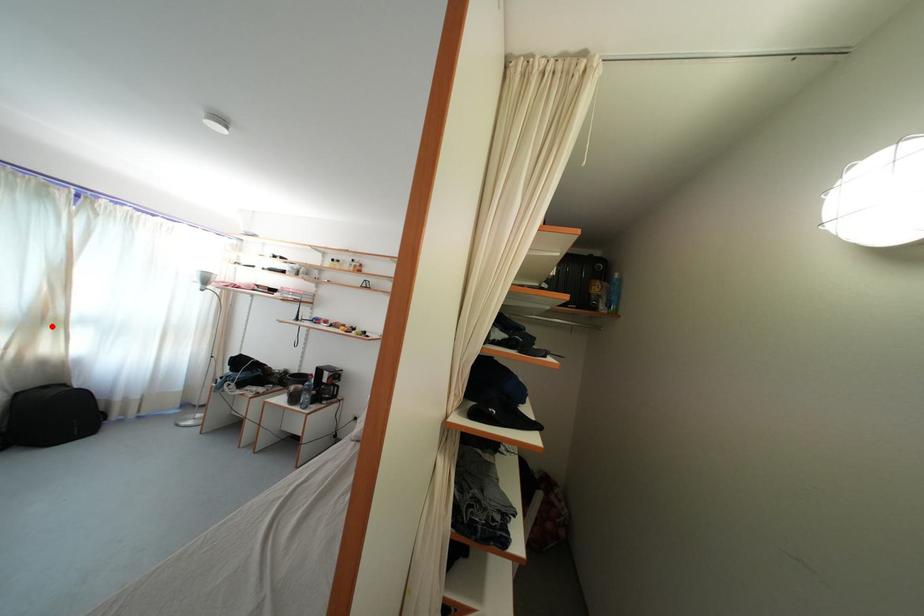
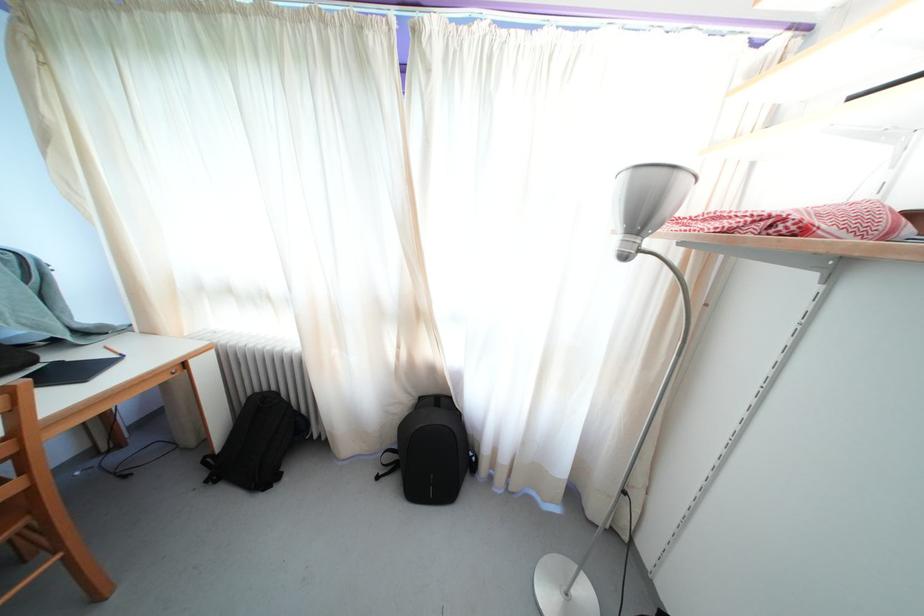
Question: I am providing you with two images of the same scene from different viewpoints. Image1 has a red point marked. In image2, the corresponding 3D location appears at what relative position? Reply with the corresponding letter.

Choices:
 (A) Closer
 (B) Farther

Answer: (B)